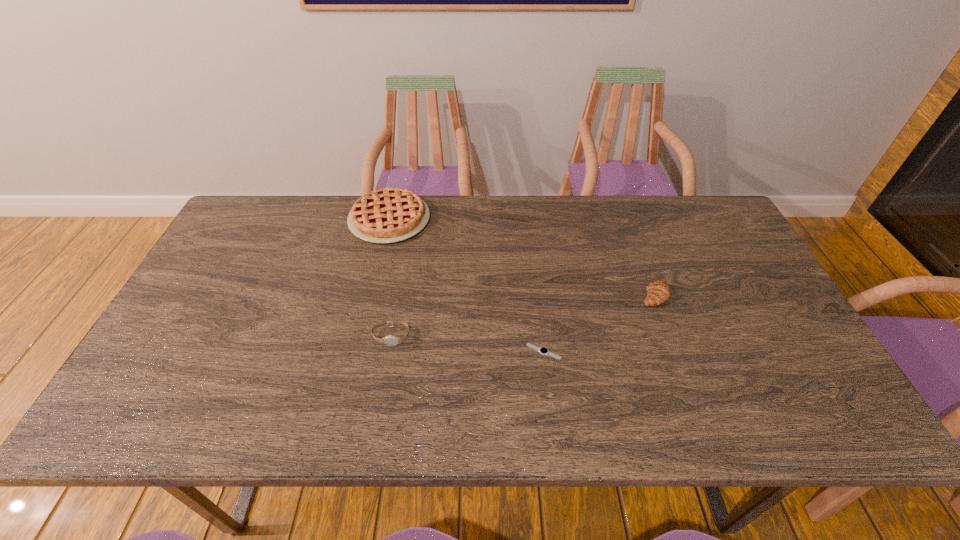
The height and width of the screenshot is (540, 960). Find the location of `the second closest object to the rightmost object`. the second closest object to the rightmost object is located at coordinates (390, 340).

The height and width of the screenshot is (540, 960). In order to click on free space that satisfies the following two spatial constraints: 1. on the front side of the right watch; 2. on the right side of the farthest object in this screenshot , I will do `click(359, 352)`.

The height and width of the screenshot is (540, 960). Identify the location of vacant space that satisfies the following two spatial constraints: 1. on the front side of the rightmost object; 2. on the left side of the tallest object. (372, 294).

At what (x,y) coordinates should I click in order to perform the action: click on blank area in the image that satisfies the following two spatial constraints: 1. on the face of the left watch; 2. on the left side of the shorter watch. Please return your answer as a coordinate pair (x, y). Looking at the image, I should click on (389, 352).

This screenshot has height=540, width=960. I want to click on vacant area that satisfies the following two spatial constraints: 1. on the face of the left watch; 2. on the right side of the right watch, so click(389, 352).

Find the location of a particular element. free point that satisfies the following two spatial constraints: 1. on the face of the left watch; 2. on the left side of the second object from right to left is located at coordinates (389, 352).